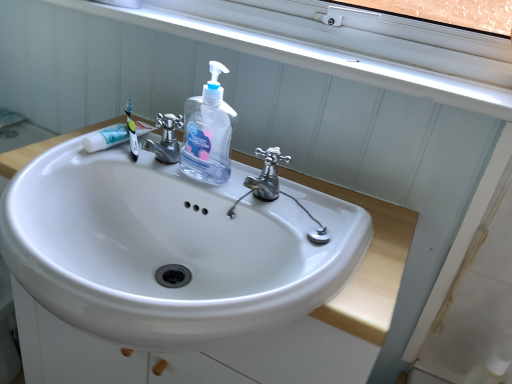
Question: Considering the positions of point 189,173 and point 170,120, is point 189,173 closer or farther from the camera than point 170,120?

Choices:
 (A) farther
 (B) closer

Answer: (B)

Question: From their relative heights in the image, would you say transparent plastic hand soap at center is taller or shorter than silver metallic faucet at center, which is the 2th tap in right-to-left order?

Choices:
 (A) tall
 (B) short

Answer: (A)

Question: Which object is positioned farthest from the silver metallic faucet at center, positioned as the first tap in left-to-right order?

Choices:
 (A) polished chrome tap at center, arranged as the 1th tap when viewed from the right
 (B) white glossy sink at center
 (C) transparent plastic hand soap at center
 (D) black plastic toothbrush at upper left
 (E) white glossy tube at upper left

Answer: (B)

Question: Which of these objects is positioned farthest from the polished chrome tap at center, arranged as the 1th tap when viewed from the right?

Choices:
 (A) white glossy sink at center
 (B) white plastic window sill at upper center
 (C) silver metallic faucet at center, which is the 2th tap in right-to-left order
 (D) white glossy tube at upper left
 (E) black plastic toothbrush at upper left

Answer: (B)